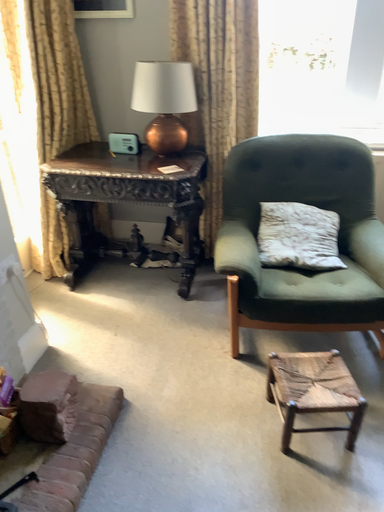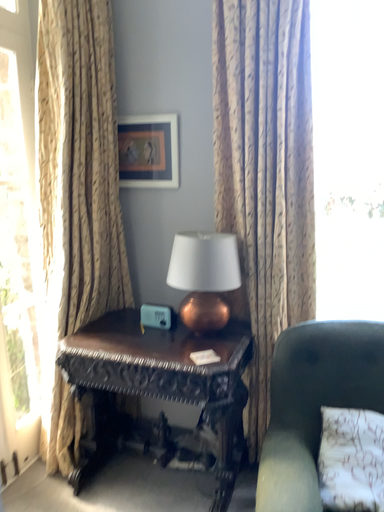
Question: Which way did the camera rotate in the video?

Choices:
 (A) rotated right
 (B) rotated left

Answer: (B)